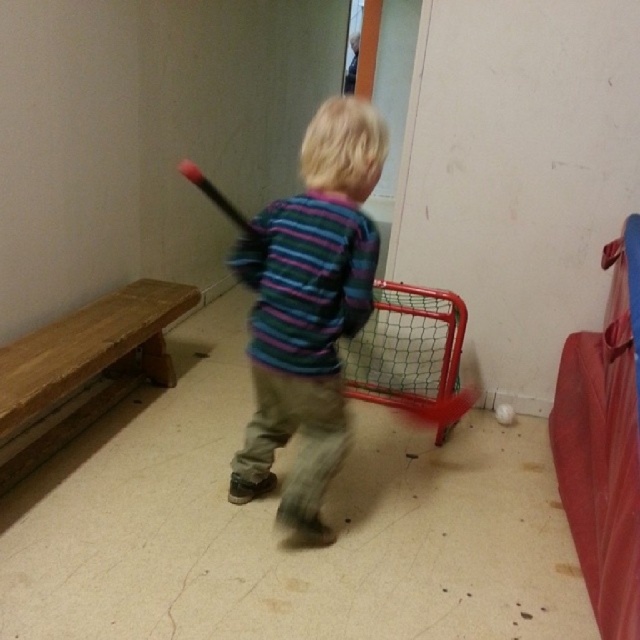
You are a photographer trying to capture a clear shot of the striped fabric shirt at center and the smooth plastic bat at center. Since the child is moving, you want to focus on the object that is closer to the camera. Which object should you focus on?

The striped fabric shirt at center is positioned on the right side of smooth plastic bat at center, so you should focus on the smooth plastic bat at center to ensure it is in focus since it is closer to the camera.

Based on the scene description, what is located at the coordinates point (308, 308)?

The striped fabric shirt at center is located at point (308, 308).